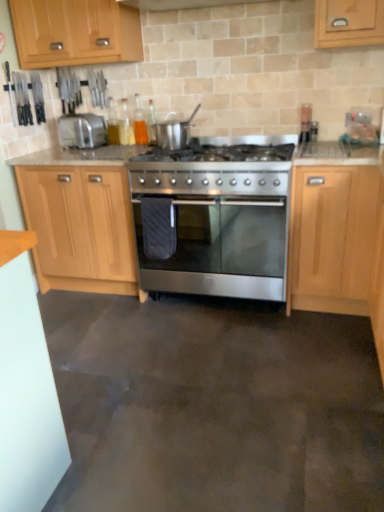
What do you see at coordinates (220, 252) in the screenshot? I see `stainless steel oven at center` at bounding box center [220, 252].

The image size is (384, 512). Find the location of `satin silver pot at center`. satin silver pot at center is located at coordinates (172, 131).

Considering the sizes of objects light wood/texture cabinet at left, placed as the 2th cabinetry when sorted from right to left, and glossy wood cabinet at center, which is counted as the third cabinetry, starting from the left, in the image provided, who is thinner, light wood/texture cabinet at left, placed as the 2th cabinetry when sorted from right to left, or glossy wood cabinet at center, which is counted as the third cabinetry, starting from the left,?

Thinner between the two is glossy wood cabinet at center, which is counted as the third cabinetry, starting from the left.

What's the angular difference between light wood/texture cabinet at left, acting as the 2th cabinetry starting from the left, and glossy wood cabinet at center, which is counted as the third cabinetry, starting from the left,'s facing directions?

They differ by 0.202 degrees in their facing directions.

From the image's perspective, who appears lower, light wood/texture cabinet at left, acting as the 2th cabinetry starting from the left, or glossy wood cabinet at center, which is counted as the first cabinetry, starting from the right?

glossy wood cabinet at center, which is counted as the first cabinetry, starting from the right, appears lower in the image.

Is light wood/texture cabinet at left, placed as the 2th cabinetry when sorted from right to left, far away from glossy wood cabinet at center, which is counted as the first cabinetry, starting from the right?

Absolutely, light wood/texture cabinet at left, placed as the 2th cabinetry when sorted from right to left, is distant from glossy wood cabinet at center, which is counted as the first cabinetry, starting from the right.

Based on the photo, which is more to the left, light wood/finish cabinet at upper left, which is the first cabinetry in left-to-right order, or silver metallic toaster at left?

From the viewer's perspective, silver metallic toaster at left appears more on the left side.

Which of these two, light wood/finish cabinet at upper left, which is the first cabinetry in left-to-right order, or silver metallic toaster at left, stands shorter?

silver metallic toaster at left is shorter.

The image size is (384, 512). In order to click on cabinetry that is above the silver metallic toaster at left (from a real-world perspective) in this screenshot , I will do `click(75, 32)`.

From the image's perspective, which one is positioned higher, stainless steel oven at center or light wood/finish cabinet at upper left, which is the first cabinetry in left-to-right order?

light wood/finish cabinet at upper left, which is the first cabinetry in left-to-right order, is shown above in the image.

Is stainless steel oven at center positioned in front of light wood/finish cabinet at upper left, arranged as the third cabinetry when viewed from the right?

Yes, the depth of stainless steel oven at center is less than that of light wood/finish cabinet at upper left, arranged as the third cabinetry when viewed from the right.

Are stainless steel oven at center and light wood/finish cabinet at upper left, arranged as the third cabinetry when viewed from the right, located far from each other?

Yes, stainless steel oven at center and light wood/finish cabinet at upper left, arranged as the third cabinetry when viewed from the right, are located far from each other.

Is stainless steel oven at center not within light wood/finish cabinet at upper left, which is the first cabinetry in left-to-right order?

That's correct, stainless steel oven at center is outside of light wood/finish cabinet at upper left, which is the first cabinetry in left-to-right order.

Is point (72, 121) farther from camera compared to point (266, 279)?

Yes.

Locate an element on the screen. Image resolution: width=384 pixels, height=512 pixels. oven on the right of silver metallic toaster at left is located at coordinates (220, 252).

From the image's perspective, which is below, silver metallic toaster at left or stainless steel oven at center?

From the image's view, stainless steel oven at center is below.

Between silver metallic toaster at left and stainless steel oven at center, which one has less height?

silver metallic toaster at left.

I want to click on oven behind the stainless steel gas stove at center, so click(220, 252).

Can you confirm if stainless steel oven at center is thinner than stainless steel gas stove at center?

Incorrect, the width of stainless steel oven at center is not less than that of stainless steel gas stove at center.

Does stainless steel oven at center have a lesser height compared to stainless steel gas stove at center?

No, stainless steel oven at center is not shorter than stainless steel gas stove at center.

Considering the relative positions of light wood/texture cabinet at left, acting as the 2th cabinetry starting from the left, and stainless steel gas stove at center in the image provided, is light wood/texture cabinet at left, acting as the 2th cabinetry starting from the left, behind stainless steel gas stove at center?

Yes, light wood/texture cabinet at left, acting as the 2th cabinetry starting from the left, is behind stainless steel gas stove at center.

Does point (65, 174) come closer to viewer compared to point (290, 146)?

No, it is not.

Measure the distance from light wood/texture cabinet at left, acting as the 2th cabinetry starting from the left, to stainless steel gas stove at center.

They are 54.19 centimeters apart.

Which is more to the left, stainless steel gas stove at center or silver metallic toaster at left?

silver metallic toaster at left.

Image resolution: width=384 pixels, height=512 pixels. In order to click on gas stove lying on the right of silver metallic toaster at left in this screenshot , I will do `click(211, 167)`.

From the image's perspective, which is above, stainless steel gas stove at center or silver metallic toaster at left?

From the image's view, silver metallic toaster at left is above.

The image size is (384, 512). I want to click on cabinetry that is the 2nd object located in front of the light wood/texture cabinet at left, placed as the 2th cabinetry when sorted from right to left, so click(x=332, y=238).

Locate an element on the screen. cabinetry that appears above the silver metallic toaster at left (from a real-world perspective) is located at coordinates (75, 32).

Based on their spatial positions, is light wood/texture cabinet at left, placed as the 2th cabinetry when sorted from right to left, or silver metallic toaster at left closer to stainless steel gas stove at center?

The object closer to stainless steel gas stove at center is light wood/texture cabinet at left, placed as the 2th cabinetry when sorted from right to left.

Which object lies further to the anchor point glossy wood cabinet at center, which is counted as the third cabinetry, starting from the left, satin silver pot at center or light wood/finish cabinet at upper left, which is the first cabinetry in left-to-right order?

Among the two, light wood/finish cabinet at upper left, which is the first cabinetry in left-to-right order, is located further to glossy wood cabinet at center, which is counted as the third cabinetry, starting from the left.

When comparing their distances from glossy wood cabinet at center, which is counted as the first cabinetry, starting from the right, does light wood/finish cabinet at upper left, which is the first cabinetry in left-to-right order, or silver metallic toaster at left seem further?

Based on the image, silver metallic toaster at left appears to be further to glossy wood cabinet at center, which is counted as the first cabinetry, starting from the right.

Based on the photo, based on their spatial positions, is light wood/finish cabinet at upper left, which is the first cabinetry in left-to-right order, or satin silver pot at center further from stainless steel gas stove at center?

light wood/finish cabinet at upper left, which is the first cabinetry in left-to-right order, lies further to stainless steel gas stove at center than the other object.

Looking at the image, which one is located further to stainless steel gas stove at center, light wood/finish cabinet at upper left, arranged as the third cabinetry when viewed from the right, or glossy wood cabinet at center, which is counted as the third cabinetry, starting from the left?

light wood/finish cabinet at upper left, arranged as the third cabinetry when viewed from the right.

Based on their spatial positions, is stainless steel oven at center or satin silver pot at center further from glossy wood cabinet at center, which is counted as the third cabinetry, starting from the left?

satin silver pot at center lies further to glossy wood cabinet at center, which is counted as the third cabinetry, starting from the left, than the other object.

Considering their positions, is light wood/finish cabinet at upper left, arranged as the third cabinetry when viewed from the right, positioned closer to stainless steel oven at center than silver metallic toaster at left?

Based on the image, silver metallic toaster at left appears to be nearer to stainless steel oven at center.

When comparing their distances from stainless steel gas stove at center, does light wood/texture cabinet at left, placed as the 2th cabinetry when sorted from right to left, or light wood/finish cabinet at upper left, which is the first cabinetry in left-to-right order, seem further?

The object further to stainless steel gas stove at center is light wood/finish cabinet at upper left, which is the first cabinetry in left-to-right order.

The image size is (384, 512). Identify the location of gas stove between light wood/texture cabinet at left, acting as the 2th cabinetry starting from the left, and glossy wood cabinet at center, which is counted as the third cabinetry, starting from the left, in the horizontal direction. (211, 167).

You are a GUI agent. You are given a task and a screenshot of the screen. Output one action in this format:
    pyautogui.click(x=<x>, y=<y>)
    Task: Click on the appliance between silver metallic toaster at left and stainless steel gas stove at center from left to right
    
    Given the screenshot: What is the action you would take?
    tap(172, 131)

You are a GUI agent. You are given a task and a screenshot of the screen. Output one action in this format:
    pyautogui.click(x=<x>, y=<y>)
    Task: Click on the kitchen appliance between light wood/finish cabinet at upper left, arranged as the third cabinetry when viewed from the right, and light wood/texture cabinet at left, placed as the 2th cabinetry when sorted from right to left, vertically
    The image size is (384, 512).
    Given the screenshot: What is the action you would take?
    pyautogui.click(x=82, y=130)

Locate an element on the screen. This screenshot has height=512, width=384. appliance between light wood/finish cabinet at upper left, arranged as the third cabinetry when viewed from the right, and stainless steel gas stove at center is located at coordinates (172, 131).